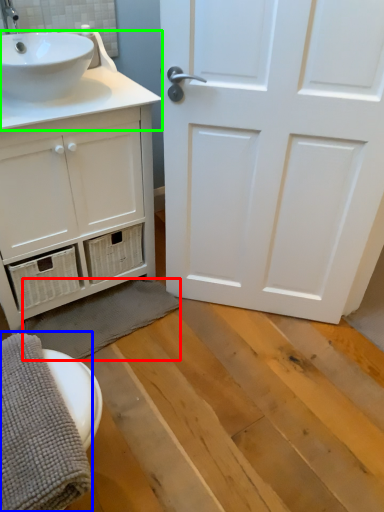
Question: Estimate the real-world distances between objects in this image. Which object is farther from bath towel (highlighted by a red box), bath towel (highlighted by a blue box) or counter top (highlighted by a green box)?

Choices:
 (A) bath towel
 (B) counter top

Answer: (B)